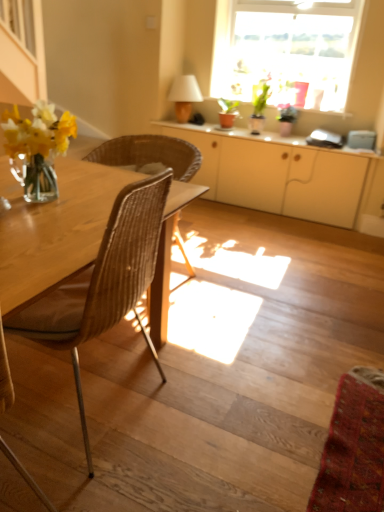
Find the location of a particular element. matte beige lampshade at upper center is located at coordinates (184, 96).

Image resolution: width=384 pixels, height=512 pixels. What do you see at coordinates (184, 96) in the screenshot?
I see `matte beige lampshade at upper center` at bounding box center [184, 96].

The image size is (384, 512). Identify the location of woven wood chair at left. (54, 229).

What do you see at coordinates (54, 229) in the screenshot? The image size is (384, 512). I see `woven wood chair at left` at bounding box center [54, 229].

At what (x,y) coordinates should I click in order to perform the action: click on wooden stairs at lower left. Please return your answer as a coordinate pair (x, y). This screenshot has width=384, height=512. Looking at the image, I should click on (209, 384).

Find the location of `green glossy plant at upper center`. green glossy plant at upper center is located at coordinates (x=259, y=105).

At what (x,y) coordinates should I click in order to perform the action: click on brown woven chair at left. Please return your answer as a coordinate pair (x, y). Image resolution: width=384 pixels, height=512 pixels. Looking at the image, I should click on (104, 283).

What is the approximate width of brown woven chair at left?

The width of brown woven chair at left is 24.07 inches.

Identify the location of white glossy cabinet at center. The image size is (384, 512). (221, 133).

Which of these two, translucent glass window at upper center or matte beige lampshade at upper center, stands shorter?

With less height is matte beige lampshade at upper center.

Can you confirm if translucent glass window at upper center is wider than matte beige lampshade at upper center?

Indeed, translucent glass window at upper center has a greater width compared to matte beige lampshade at upper center.

Is point (353, 41) positioned after point (187, 109)?

That is False.

From a real-world perspective, is translucent glass window at upper center above or below matte beige lampshade at upper center?

Clearly, from a real-world perspective, translucent glass window at upper center is above matte beige lampshade at upper center.

Considering the positions of points (172, 95) and (335, 185), is point (172, 95) closer to camera compared to point (335, 185)?

That is False.

Consider the image. Does matte beige lampshade at upper center have a greater height compared to matte white cabinet at center?

Incorrect, the height of matte beige lampshade at upper center is not larger of that of matte white cabinet at center.

From the image's perspective, does matte beige lampshade at upper center appear lower than matte white cabinet at center?

No, from the image's perspective, matte beige lampshade at upper center is not below matte white cabinet at center.

Is matte white cabinet at center inside the boundaries of green glossy plant at upper center, or outside?

matte white cabinet at center exists outside the volume of green glossy plant at upper center.

Does matte white cabinet at center appear on the right side of green glossy plant at upper center?

No.

Which of these two, matte white cabinet at center or green glossy plant at upper center, stands taller?

With more height is matte white cabinet at center.

Considering their positions, is green glossy plant at upper center located in front of or behind woven wood chair at left?

green glossy plant at upper center is behind woven wood chair at left.

Is point (258, 113) in front of point (94, 175)?

No, it is behind (94, 175).

In the scene shown: Is green glossy plant at upper center in contact with woven wood chair at left?

No, green glossy plant at upper center is not making contact with woven wood chair at left.

Is wooden stairs at lower left directly adjacent to translucent glass window at upper center?

No, wooden stairs at lower left is not making contact with translucent glass window at upper center.

Is translucent glass window at upper center completely or partially inside wooden stairs at lower left?

No, translucent glass window at upper center is not inside wooden stairs at lower left.

Which object is positioned more to the left, wooden stairs at lower left or translucent glass window at upper center?

wooden stairs at lower left is more to the left.

In the scene shown: From the image's perspective, does wooden stairs at lower left appear higher than translucent glass window at upper center?

No, from the image's perspective, wooden stairs at lower left is not on top of translucent glass window at upper center.

Is green glossy plant at upper center with translucent glass window at upper center?

No.

Image resolution: width=384 pixels, height=512 pixels. I want to click on houseplant that is under the translucent glass window at upper center (from a real-world perspective), so click(x=259, y=105).

Which of these two, green glossy plant at upper center or translucent glass window at upper center, is thinner?

With smaller width is green glossy plant at upper center.

Considering the relative sizes of wooden stairs at lower left and woven wood chair at left in the image provided, is wooden stairs at lower left smaller than woven wood chair at left?

Indeed, wooden stairs at lower left has a smaller size compared to woven wood chair at left.

From the image's perspective, is wooden stairs at lower left under woven wood chair at left?

Yes, from the image's perspective, wooden stairs at lower left is below woven wood chair at left.

Between wooden stairs at lower left and woven wood chair at left, which one appears on the left side from the viewer's perspective?

From the viewer's perspective, woven wood chair at left appears more on the left side.

How distant is wooden stairs at lower left from woven wood chair at left?

A distance of 24.04 inches exists between wooden stairs at lower left and woven wood chair at left.

Where is `window in front of the matte beige lampshade at upper center`? This screenshot has width=384, height=512. window in front of the matte beige lampshade at upper center is located at coordinates (286, 50).

You are a GUI agent. You are given a task and a screenshot of the screen. Output one action in this format:
    pyautogui.click(x=<x>, y=<y>)
    Task: Click on the lamp that is on the left side of matte white cabinet at center
    This screenshot has width=384, height=512.
    Given the screenshot: What is the action you would take?
    pyautogui.click(x=184, y=96)

Looking at this image, which object lies further to the anchor point translucent glass window at upper center, green glossy plant at upper center or white glossy cabinet at center?

The object further to translucent glass window at upper center is white glossy cabinet at center.

Based on their spatial positions, is wooden stairs at lower left or white glossy cabinet at center further from green glossy plant at upper center?

Among the two, wooden stairs at lower left is located further to green glossy plant at upper center.

Estimate the real-world distances between objects in this image. Which object is further from matte white cabinet at center, wooden stairs at lower left or white glossy cabinet at center?

wooden stairs at lower left lies further to matte white cabinet at center than the other object.

From the image, which object appears to be farther from brown woven chair at left, matte beige lampshade at upper center or woven wood chair at left?

matte beige lampshade at upper center lies further to brown woven chair at left than the other object.

When comparing their distances from green glossy plant at upper center, does brown woven chair at left or wooden stairs at lower left seem further?

brown woven chair at left.

Considering their positions, is matte white cabinet at center positioned closer to green glossy plant at upper center than brown woven chair at left?

The object closer to green glossy plant at upper center is matte white cabinet at center.

Based on their spatial positions, is woven wood chair at left or wooden stairs at lower left further from white glossy cabinet at center?

woven wood chair at left.

Based on the photo, based on their spatial positions, is brown woven chair at left or matte white cabinet at center closer to translucent glass window at upper center?

matte white cabinet at center lies closer to translucent glass window at upper center than the other object.

What are the coordinates of `window between wooden stairs at lower left and white glossy cabinet at center from front to back` in the screenshot? It's located at (286, 50).

The height and width of the screenshot is (512, 384). What are the coordinates of `window between brown woven chair at left and white glossy cabinet at center in the front-back direction` in the screenshot? It's located at (286, 50).

I want to click on round table positioned between wooden stairs at lower left and matte white cabinet at center from near to far, so click(x=54, y=229).

Locate an element on the screen. This screenshot has width=384, height=512. houseplant that lies between translucent glass window at upper center and white glossy cabinet at center from top to bottom is located at coordinates (259, 105).